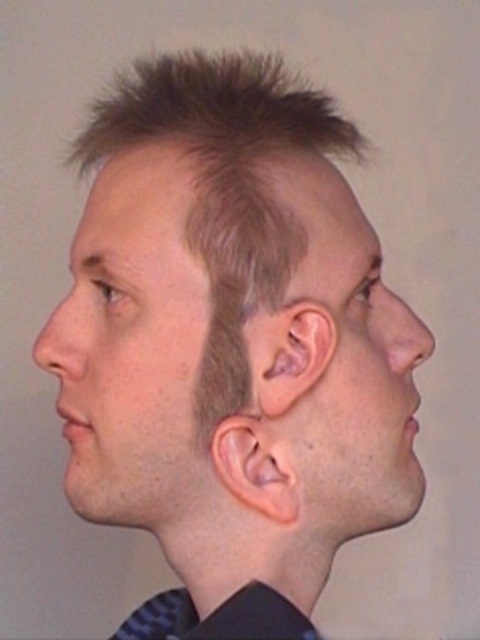
Based on the photo, you are an artist sketching the profile of the person in the image. You need to draw the point at position point (265, 378) and point (297, 499). Which point should you draw first to ensure proper layering?

Point (265, 378) should be drawn first because it is in front of point (297, 499), so it needs to be placed over the other point.